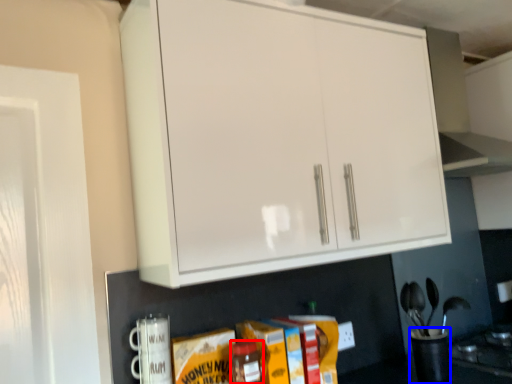
Question: Among these objects, which one is farthest to the camera, bottle (highlighted by a red box) or appliance (highlighted by a blue box)?

Choices:
 (A) bottle
 (B) appliance

Answer: (B)